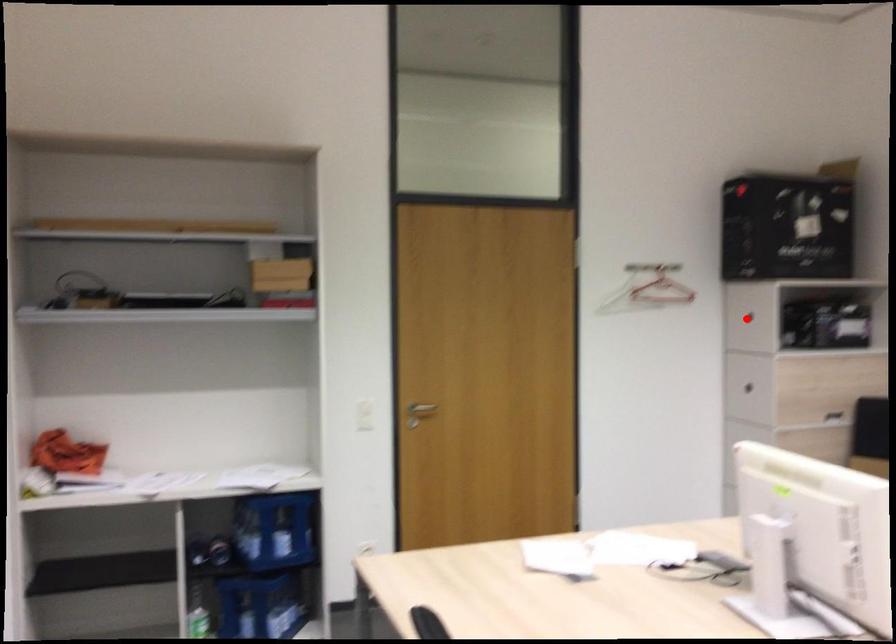
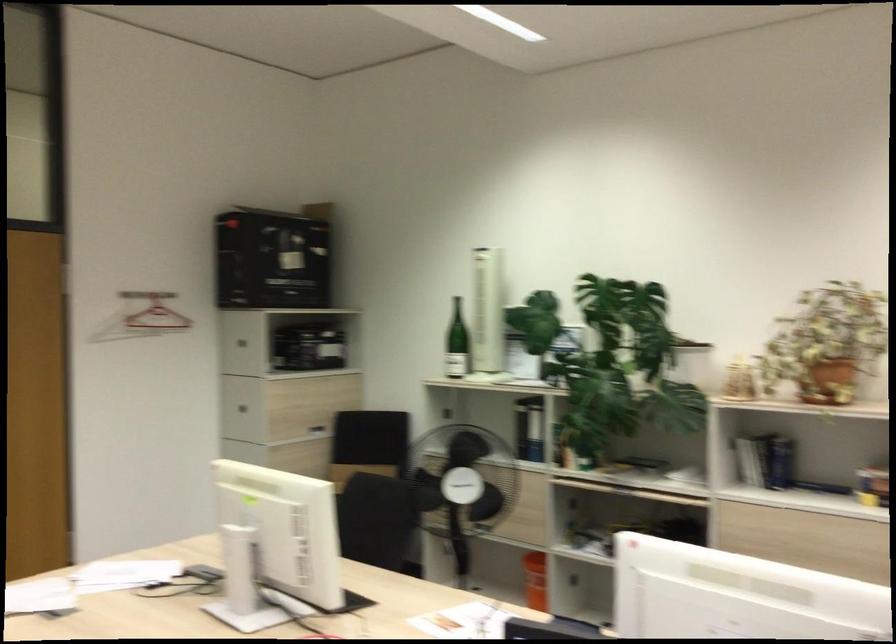
Locate, in the second image, the point that corresponds to the highlighted location in the first image.

(237, 341)